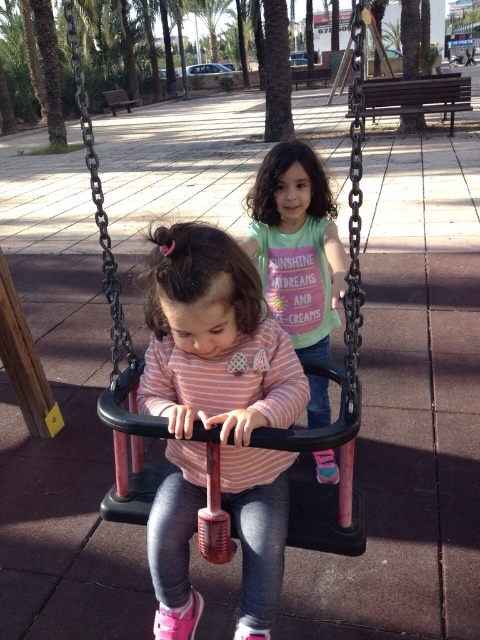
You are a parent trying to ensure your child is safe on the playground. Your child is wearing a pink and white striped shirt and is sitting on a black plastic swing. Based on the image, how far apart are the pink striped shirt at center and the black plastic swing at center?

The pink striped shirt at center and the black plastic swing at center are 27.26 inches apart.

You are a photographer trying to capture a clear shot of both the pink striped shirt at center and the matte pink shirt at center. Which one is closer to the camera?

The pink striped shirt at center is positioned under matte pink shirt at center, so the matte pink shirt at center is closer to the camera.